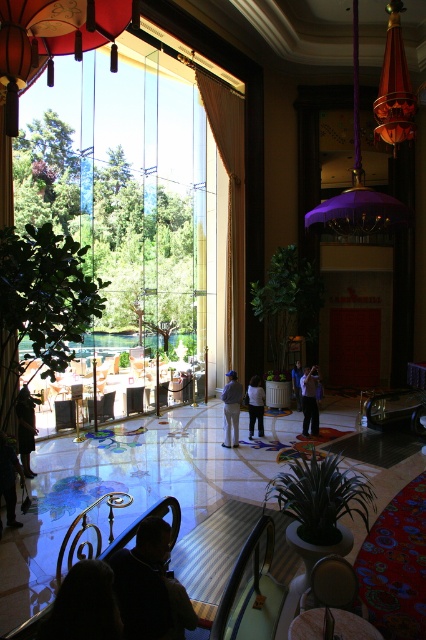
You are a fashion designer observing the luxurious interior. You notice two light blue garments at the center of the room. Which one is taller between the light blue fabric pants at center and the light blue jeans at center?

The light blue fabric pants at center is taller than the light blue jeans at center.

You are standing at the entrance of this luxurious building and see a point marked at coordinates [83,605]. What object is located at that point?

The point at coordinates [83,605] indicates the location of the dark fabric at lower center.